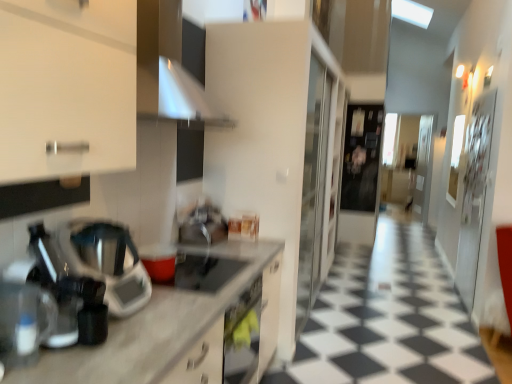
This screenshot has width=512, height=384. Identify the location of unoccupied region to the right of sleek metallic coffee machine at left, arranged as the second coffee machine when viewed from the front. coord(142,330).